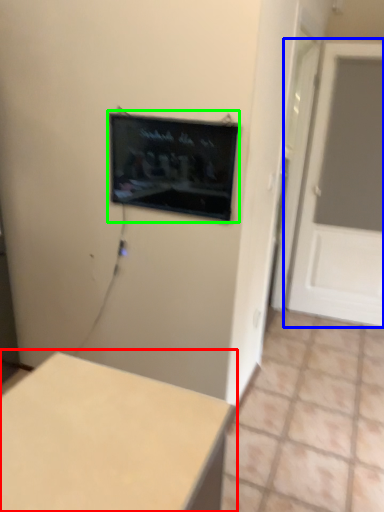
Question: Estimate the real-world distances between objects in this image. Which object is closer to table (highlighted by a red box), door (highlighted by a blue box) or computer screen (highlighted by a green box)?

Choices:
 (A) door
 (B) computer screen

Answer: (B)